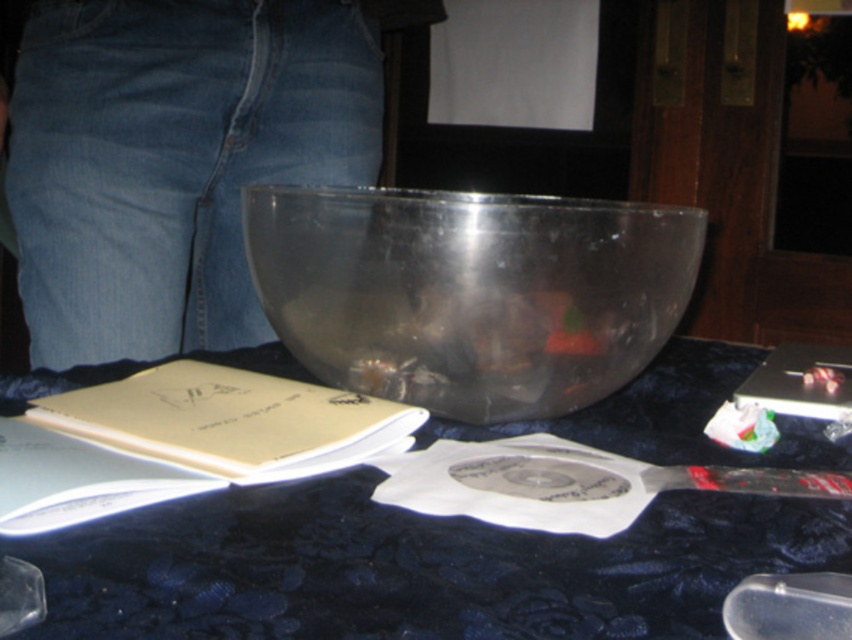
Can you confirm if denim at center is smaller than transparent plastic bowl at center?

No.

Does denim at center have a larger size compared to transparent plastic bowl at center?

Yes, denim at center is bigger than transparent plastic bowl at center.

Looking at this image, who is more distant from viewer, (208, 180) or (279, 250)?

The point (208, 180) is more distant.

Identify the location of denim at center. (171, 161).

Between transparent plastic table at center and transparent plastic bowl at center, which one has less height?

transparent plastic table at center is shorter.

Does transparent plastic table at center have a smaller size compared to transparent plastic bowl at center?

Actually, transparent plastic table at center might be larger than transparent plastic bowl at center.

Is point (642, 371) in front of point (602, 291)?

No, it is not.

At what (x,y) coordinates should I click in order to perform the action: click on transparent plastic table at center. Please return your answer as a coordinate pair (x, y). The height and width of the screenshot is (640, 852). Looking at the image, I should click on tap(413, 568).

Can you confirm if denim at center is taller than transparent plastic spoon at lower right?

Correct, denim at center is much taller as transparent plastic spoon at lower right.

Can you confirm if denim at center is thinner than transparent plastic spoon at lower right?

No.

Who is more distant from viewer, (179, 148) or (799, 621)?

The point (179, 148) is more distant.

Identify the location of denim at center. (171, 161).